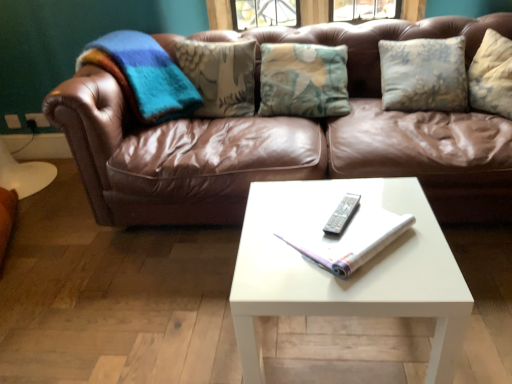
Image resolution: width=512 pixels, height=384 pixels. In order to click on free space in front of silver metallic remote at center in this screenshot , I will do `click(347, 243)`.